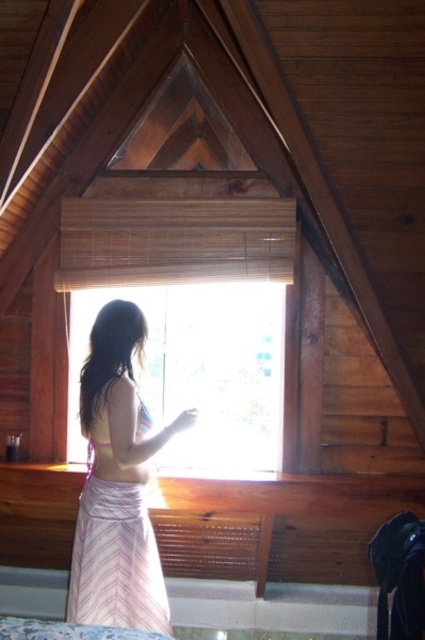
You are standing in the room and want to see the view outside the transparent glass window at center. Since the pink striped skirt at center is blocking your view, how can you adjust your position to see through the window?

The transparent glass window at center is above the pink striped skirt at center, so you can lower your head or crouch down to see through the window by positioning yourself below the pink striped skirt at center.

You are a photographer trying to capture a candid shot of the pink striped skirt at center without the transparent glass window at center reflecting in the background. Can you position yourself so that the window is not in the shot while still capturing the skirt?

The transparent glass window at center and pink striped skirt at center are 22.00 inches apart. Since they are close, you can move slightly to the side to frame the shot so the window is out of view while keeping the skirt in focus.

You are an interior designer assessing the space. You need to determine if a large decorative mirror that is the same size as the transparent glass window at center can be placed where the pink striped skirt at center is currently located. Based on the size comparison between the two objects, what would you advise?

The transparent glass window at center is bigger than the pink striped skirt at center. Therefore, the mirror, being the same size as the window, would not fit in the space where the pink striped skirt at center is located because that area is smaller.